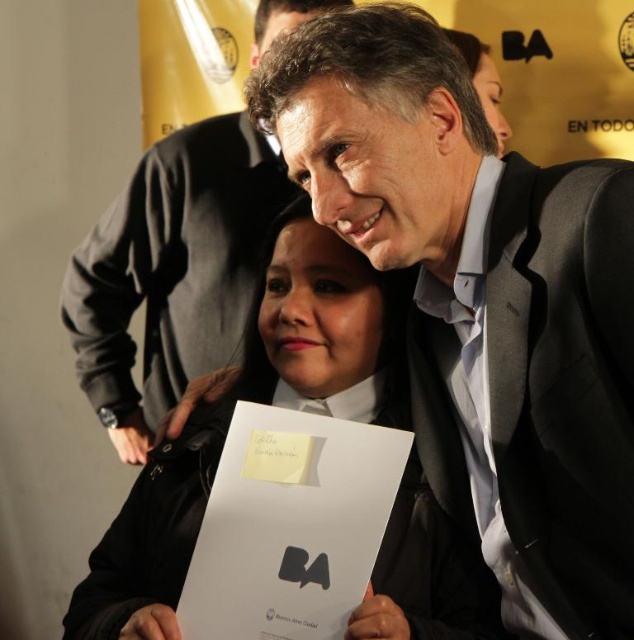
Question: Which is farther from the matte black suit at center?

Choices:
 (A) matte black jacket at center
 (B) black suit at center
 (C) dark gray suit at center

Answer: (C)

Question: Does black suit at center lie behind matte black jacket at center?

Choices:
 (A) yes
 (B) no

Answer: (B)

Question: Does black suit at center appear on the right side of matte black suit at center?

Choices:
 (A) yes
 (B) no

Answer: (A)

Question: Observing the image, what is the correct spatial positioning of dark gray suit at center in reference to matte black jacket at center?

Choices:
 (A) right
 (B) left

Answer: (A)

Question: Estimate the real-world distances between objects in this image. Which object is farther from the black suit at center?

Choices:
 (A) matte black jacket at center
 (B) dark gray suit at center
 (C) matte black suit at center

Answer: (C)

Question: Estimate the real-world distances between objects in this image. Which object is closer to the matte black suit at center?

Choices:
 (A) black suit at center
 (B) matte black jacket at center

Answer: (B)